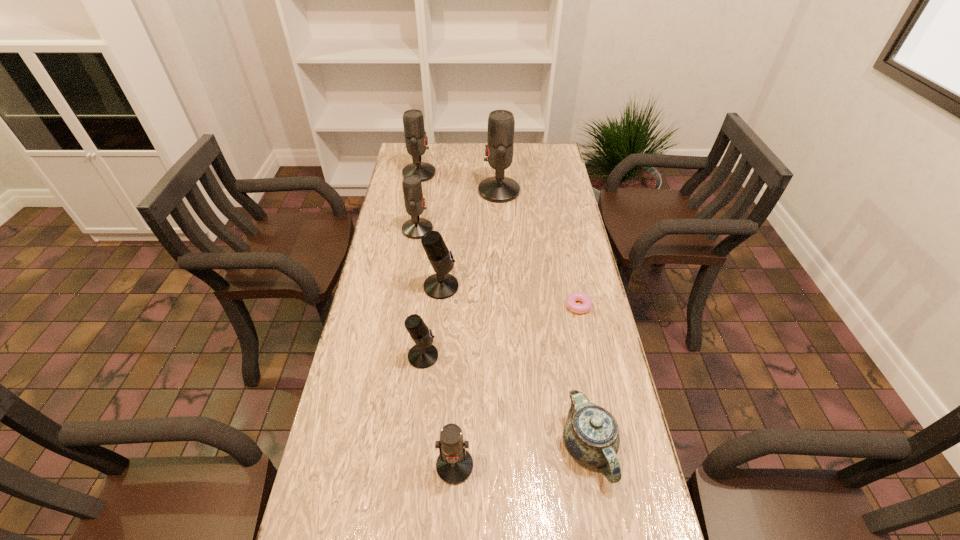
I want to click on the second red microphone from right to left, so click(454, 465).

Identify the location of the nearest red microphone. The width and height of the screenshot is (960, 540). pos(454,465).

Locate an element on the screen. the second shortest object is located at coordinates (591, 435).

The height and width of the screenshot is (540, 960). Find the location of `purple doughnut`. purple doughnut is located at coordinates (571, 300).

Identify the location of doughnut. (571, 300).

Find the location of a particular element. This screenshot has width=960, height=540. vacant space located 0.350m on the side of the rightmost microphone with the red ring is located at coordinates (393, 191).

The image size is (960, 540). Find the location of `vacant position located 0.220m on the side of the rightmost microphone with the red ring`. vacant position located 0.220m on the side of the rightmost microphone with the red ring is located at coordinates (424, 191).

You are a GUI agent. You are given a task and a screenshot of the screen. Output one action in this format:
    pyautogui.click(x=<x>, y=<y>)
    Task: Click on the free spot located on the side of the rightmost microphone with the red ring
    This screenshot has width=960, height=540.
    Given the screenshot: What is the action you would take?
    [x=446, y=191]

What are the coordinates of `vacant area situated 0.280m on the side of the third smallest red microphone with the red ring` in the screenshot? It's located at (501, 173).

What are the coordinates of `free region located 0.050m on the stand of the third nearest microphone` in the screenshot? It's located at (474, 287).